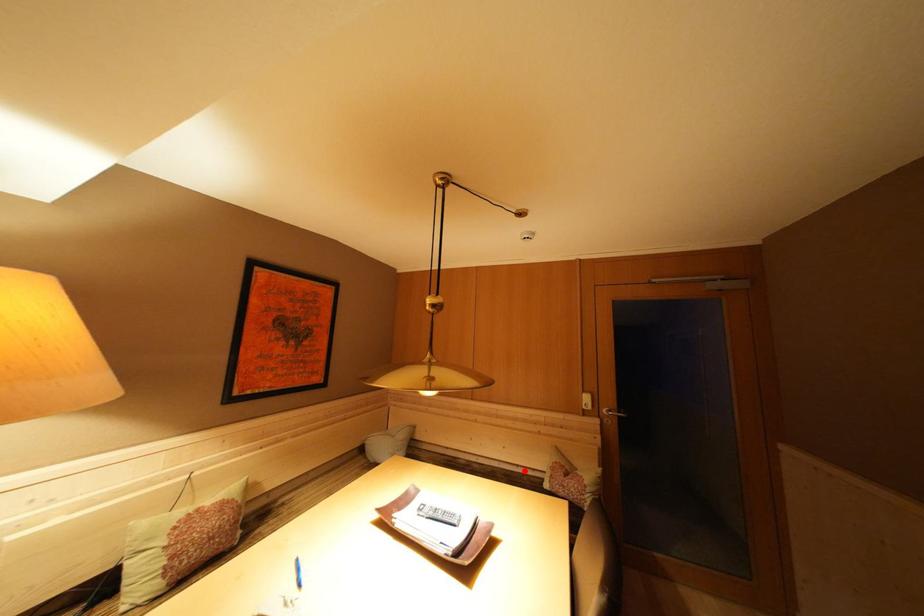
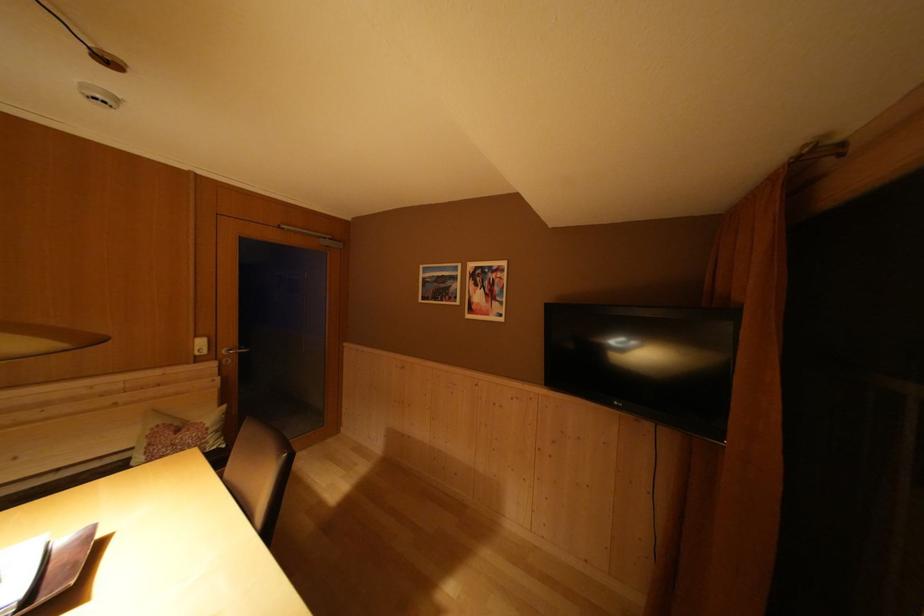
Question: A red point is marked in image1. In image2, is the corresponding 3D point closer to the camera or farther? Reply with the corresponding letter.

Choices:
 (A) The corresponding 3D point is closer.
 (B) The corresponding 3D point is farther.

Answer: (A)